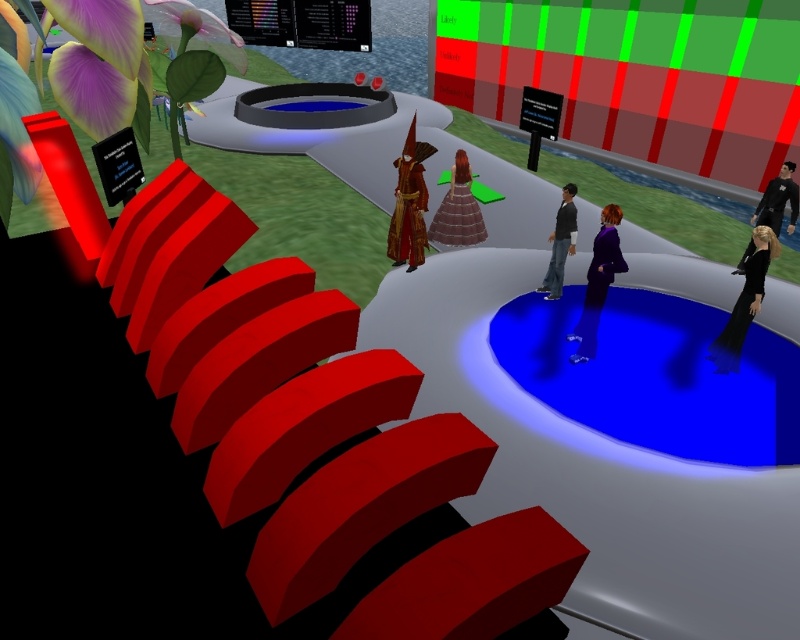
Question: Based on their relative distances, which object is nearer to the dark gray fabric jacket at center?

Choices:
 (A) purple matte dress at center
 (B) shiny brown dress at center

Answer: (A)

Question: Among these objects, which one is farthest from the camera?

Choices:
 (A) blue glossy pool at center
 (B) black matte suit at right
 (C) shiny brown dress at center
 (D) dark gray fabric jacket at center

Answer: (C)

Question: Can you confirm if shiny red cape at center is smaller than dark gray fabric jacket at center?

Choices:
 (A) no
 (B) yes

Answer: (A)

Question: Does shiny red cape at center appear on the right side of purple matte dress at center?

Choices:
 (A) yes
 (B) no

Answer: (B)

Question: Which point is farther from the camera taking this photo?

Choices:
 (A) (468, 221)
 (B) (592, 346)
 (C) (750, 280)
 (D) (516, 349)

Answer: (A)

Question: Does shiny red cape at center appear on the left side of shiny brown dress at center?

Choices:
 (A) no
 (B) yes

Answer: (B)